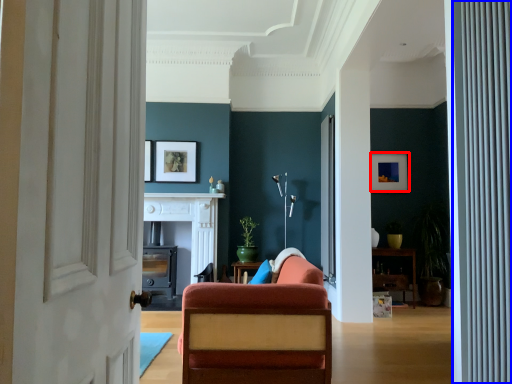
Question: Which point is further to the camera, picture frame (highlighted by a red box) or curtain (highlighted by a blue box)?

Choices:
 (A) picture frame
 (B) curtain

Answer: (A)